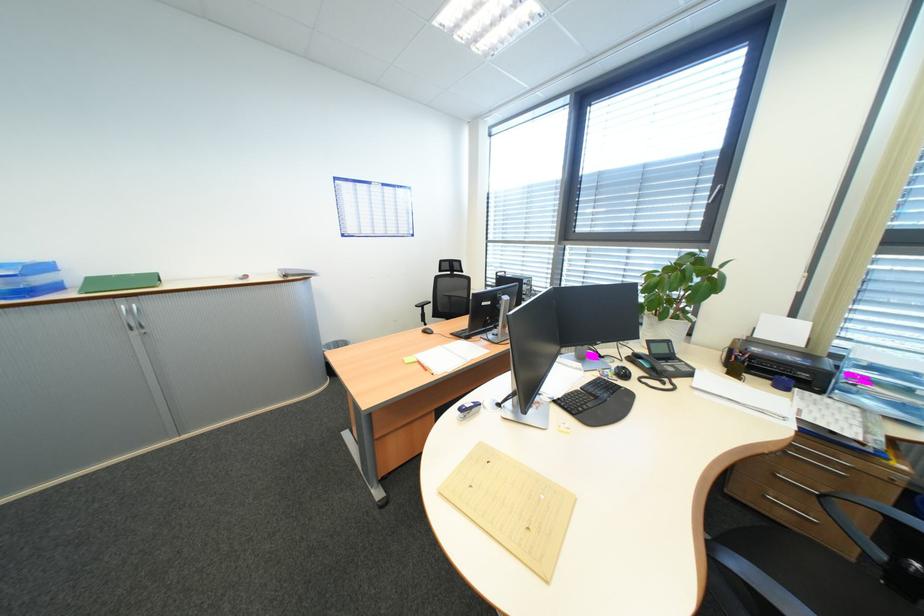
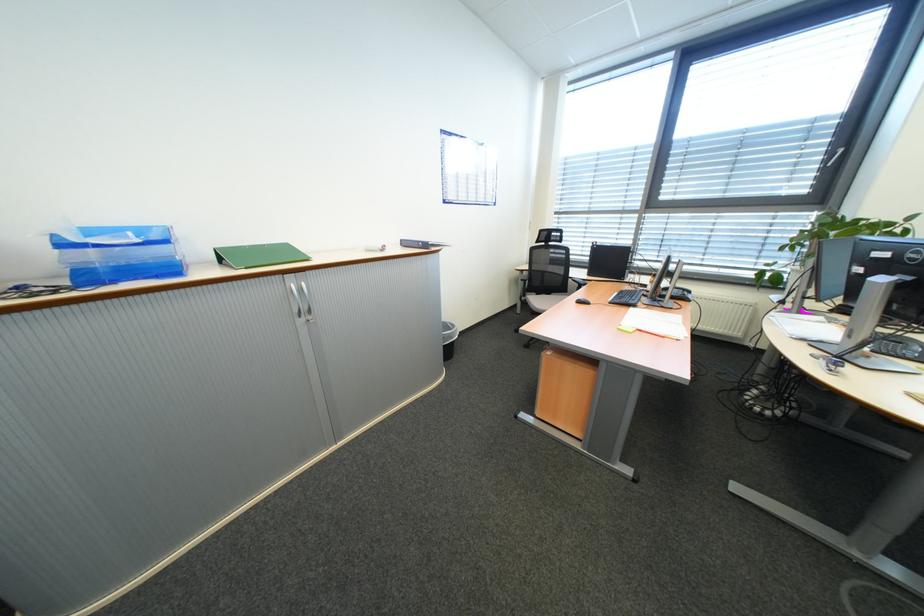
The point at (134,307) is marked in the first image. Where is the corresponding point in the second image?

(302, 286)